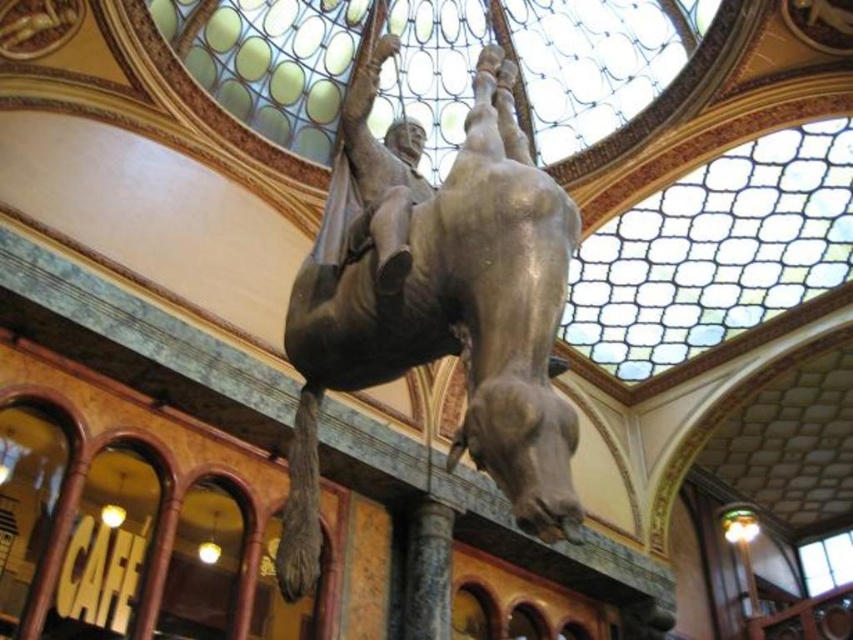
Is bronze statue at center bigger than granite column at center?

Indeed, bronze statue at center has a larger size compared to granite column at center.

The image size is (853, 640). In order to click on bronze statue at center in this screenshot , I will do `click(450, 324)`.

Which is in front, point (492, 115) or point (436, 524)?

Point (492, 115)

Image resolution: width=853 pixels, height=640 pixels. In order to click on bronze statue at center in this screenshot , I will do (x=450, y=324).